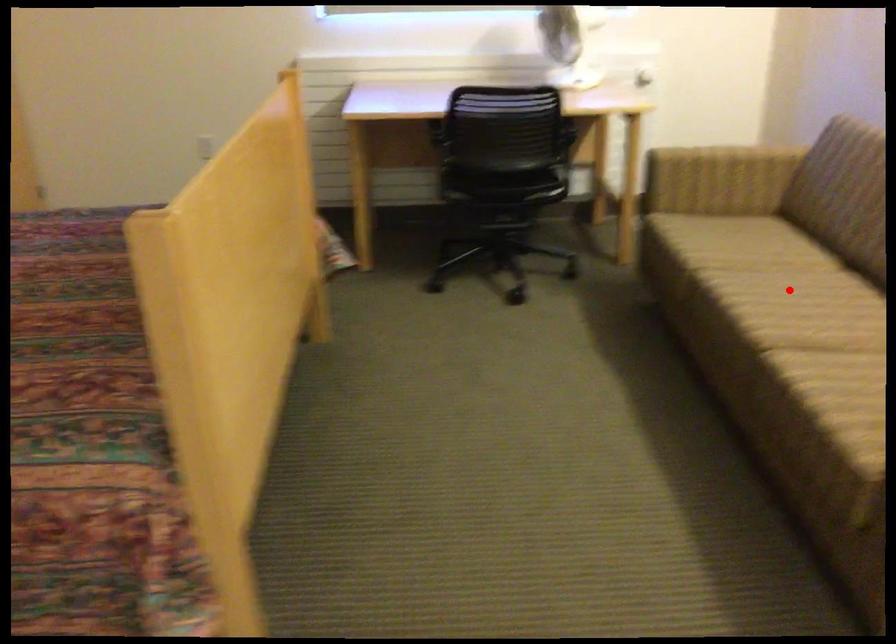
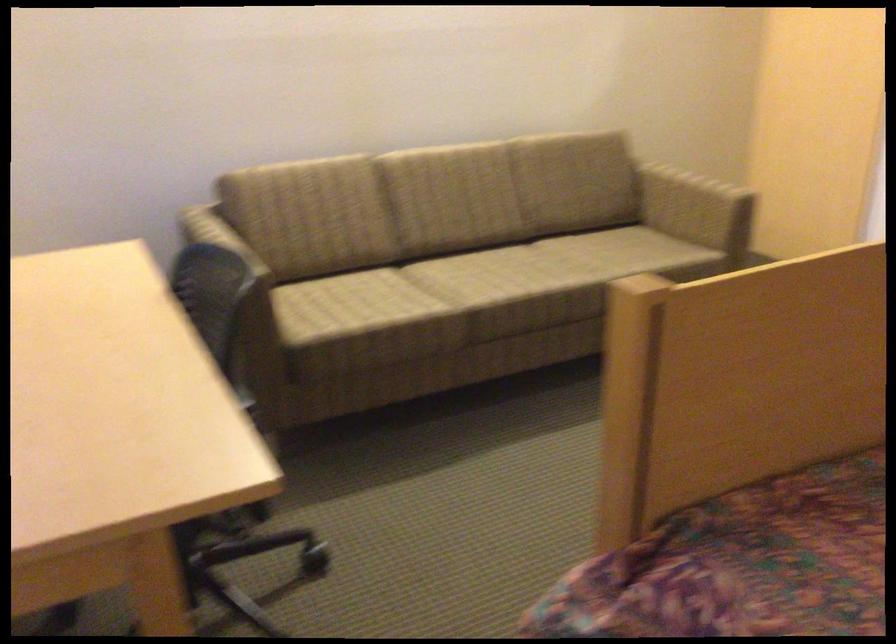
Question: A red point is marked in image1. In image2, is the corresponding 3D point closer to the camera or farther? Reply with the corresponding letter.

Choices:
 (A) The corresponding 3D point is closer.
 (B) The corresponding 3D point is farther.

Answer: (B)